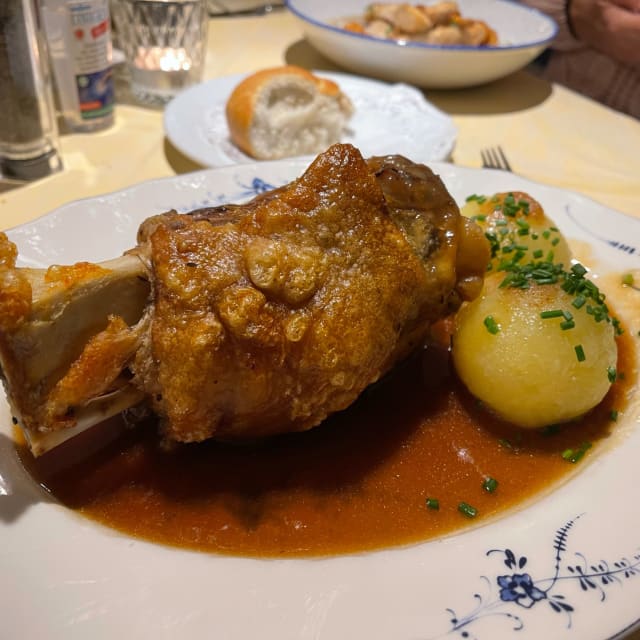
Identify the location of glass cup. (162, 22), (144, 47).